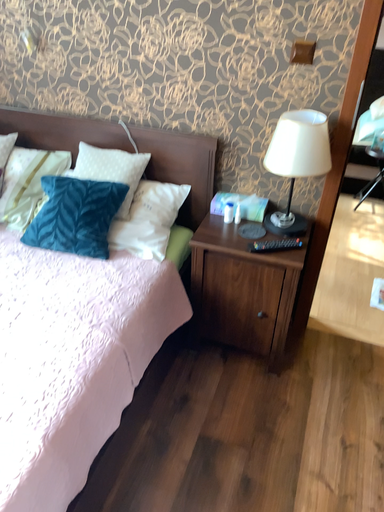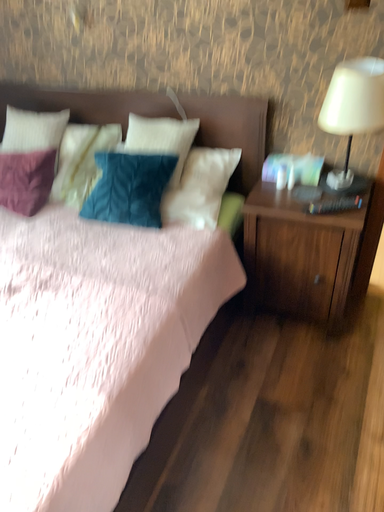
Question: How did the camera likely rotate when shooting the video?

Choices:
 (A) rotated right
 (B) rotated left

Answer: (B)